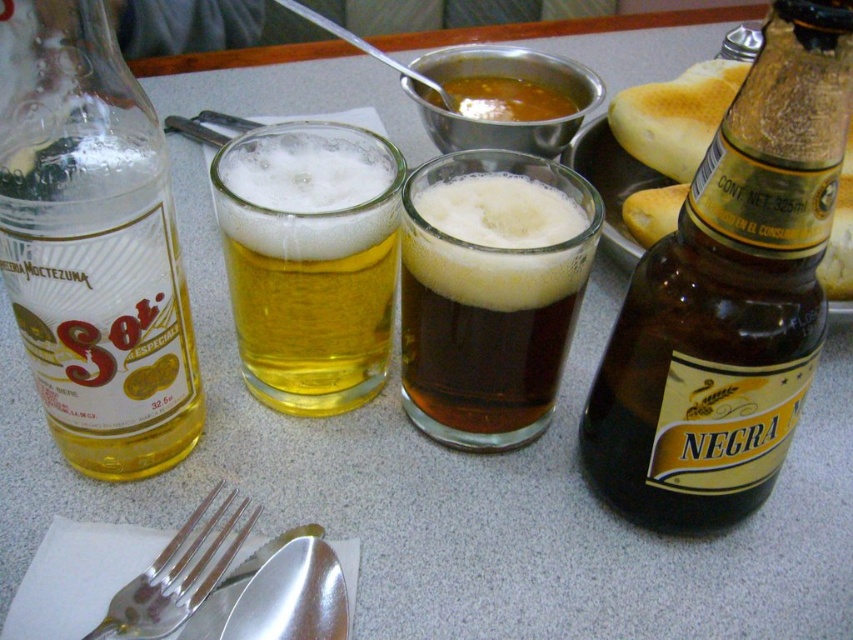
Between brown glass bottle at upper right and golden glass beer at center, which one appears on the left side from the viewer's perspective?

golden glass beer at center is more to the left.

Who is taller, brown glass bottle at upper right or golden glass beer at center?

brown glass bottle at upper right is taller.

Who is more distant from viewer, (730,484) or (294,154)?

Point (294,154)

Locate an element on the screen. The image size is (853, 640). brown glass bottle at upper right is located at coordinates (729, 294).

Who is positioned more to the right, brown glass bottle at upper right or silver metallic spoon at lower center?

Positioned to the right is brown glass bottle at upper right.

Is brown glass bottle at upper right above silver metallic spoon at lower center?

Correct, brown glass bottle at upper right is located above silver metallic spoon at lower center.

Where is `brown glass bottle at upper right`? Image resolution: width=853 pixels, height=640 pixels. brown glass bottle at upper right is located at coordinates (729, 294).

Does brown glass bottle at upper right have a greater height compared to brown matte soup at center?

Yes, brown glass bottle at upper right is taller than brown matte soup at center.

How much distance is there between brown glass bottle at upper right and brown matte soup at center?

brown glass bottle at upper right is 10.46 inches from brown matte soup at center.

Locate an element on the screen. This screenshot has height=640, width=853. brown glass bottle at upper right is located at coordinates (729, 294).